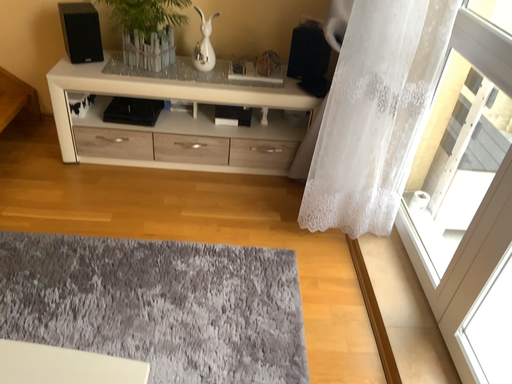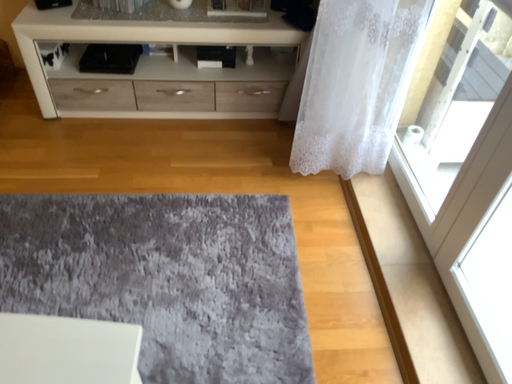
Question: How did the camera likely rotate when shooting the video?

Choices:
 (A) rotated downward
 (B) rotated upward

Answer: (A)